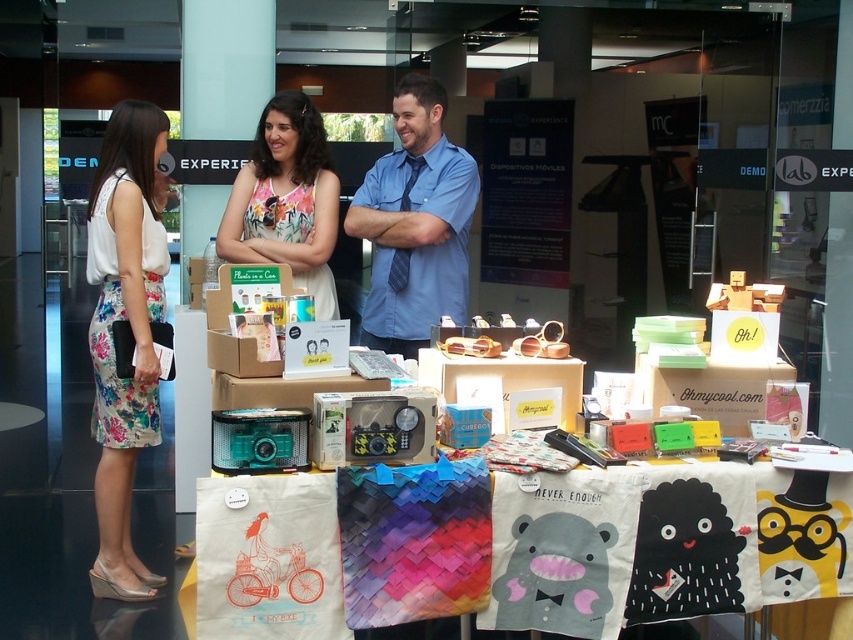
Question: Which object appears closest to the camera in this image?

Choices:
 (A) blue shirt at center
 (B) floral fabric dress at center
 (C) matte cardboard box at lower right
 (D) floral fabric skirt at left

Answer: (C)

Question: Which object is farther from the camera taking this photo?

Choices:
 (A) matte cardboard box at lower right
 (B) blue shirt at center
 (C) floral fabric dress at center

Answer: (C)

Question: Is floral fabric skirt at left wider than floral fabric dress at center?

Choices:
 (A) no
 (B) yes

Answer: (A)

Question: Estimate the real-world distances between objects in this image. Which object is farther from the canvas tote bags at center?

Choices:
 (A) floral fabric skirt at left
 (B) matte cardboard box at lower right

Answer: (A)

Question: Observing the image, what is the correct spatial positioning of floral fabric skirt at left in reference to floral fabric dress at center?

Choices:
 (A) right
 (B) left

Answer: (B)

Question: Is floral fabric skirt at left closer to camera compared to matte cardboard box at lower right?

Choices:
 (A) no
 (B) yes

Answer: (A)